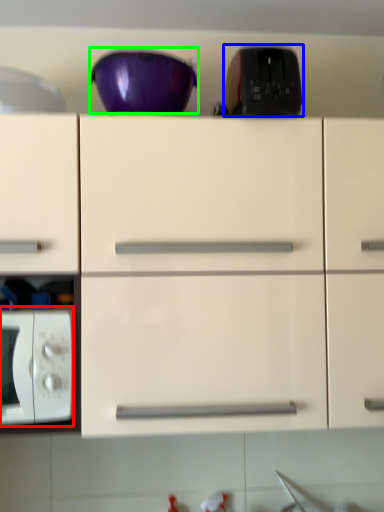
Question: Based on their relative distances, which object is nearer to microwave oven (highlighted by a red box)? Choose from appliance (highlighted by a blue box) and bowl (highlighted by a green box).

Choices:
 (A) appliance
 (B) bowl

Answer: (B)